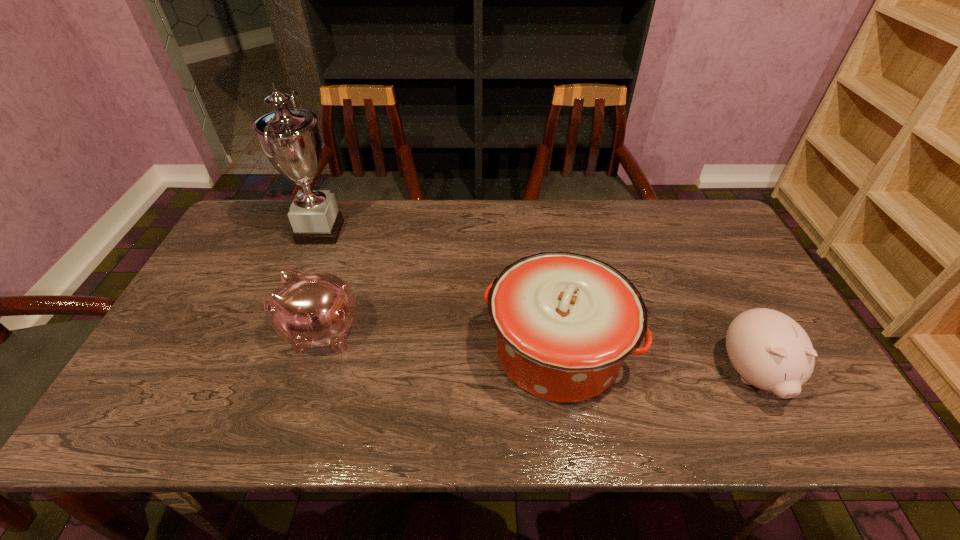
The image size is (960, 540). In order to click on free space that satisfies the following two spatial constraints: 1. on the front facing side of the casserole; 2. on the left side of the left piggy bank in this screenshot , I will do `click(316, 351)`.

Where is `vacant space that satisfies the following two spatial constraints: 1. at the front view of the second object from right to left; 2. on the right side of the tallest object`? vacant space that satisfies the following two spatial constraints: 1. at the front view of the second object from right to left; 2. on the right side of the tallest object is located at coordinates (272, 351).

Where is `free location that satisfies the following two spatial constraints: 1. on the front facing side of the casserole; 2. on the left side of the left piggy bank`? The width and height of the screenshot is (960, 540). free location that satisfies the following two spatial constraints: 1. on the front facing side of the casserole; 2. on the left side of the left piggy bank is located at coordinates (316, 351).

The image size is (960, 540). In order to click on free space that satisfies the following two spatial constraints: 1. at the front view of the tallest object; 2. on the right side of the third object from left to right in this screenshot , I will do `click(272, 351)`.

I want to click on free location that satisfies the following two spatial constraints: 1. on the front facing side of the left piggy bank; 2. on the left side of the casserole, so click(316, 351).